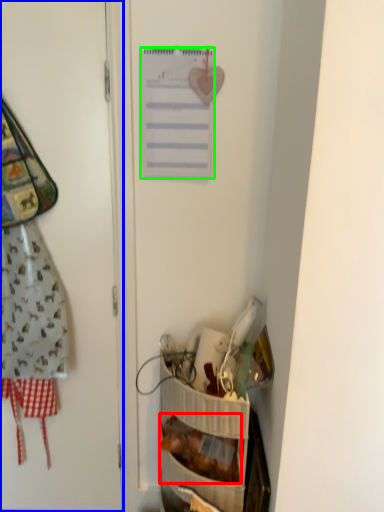
Question: Based on their relative distances, which object is nearer to food (highlighted by a red box)? Choose from door (highlighted by a blue box) and list (highlighted by a green box).

Choices:
 (A) door
 (B) list

Answer: (A)